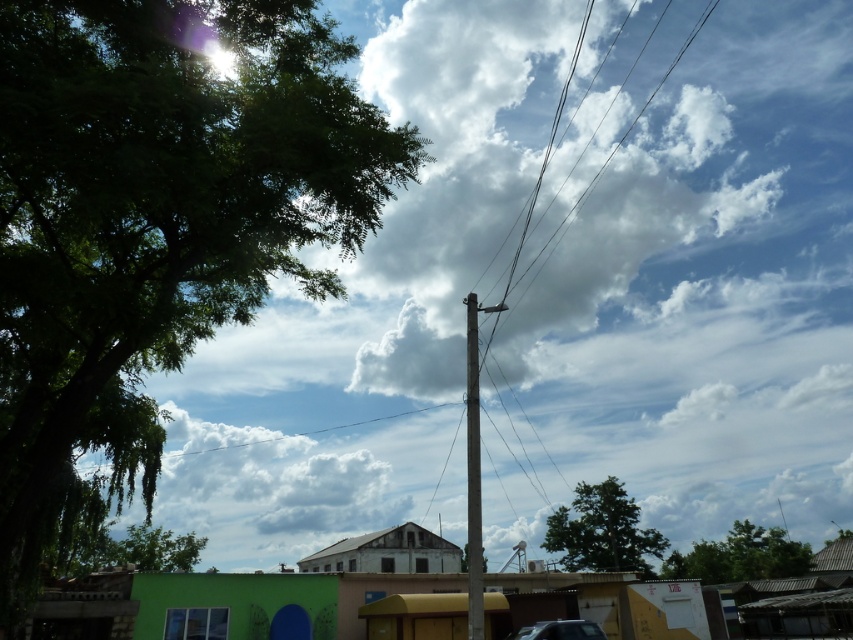
Question: Which point is closer to the camera taking this photo?

Choices:
 (A) (555, 125)
 (B) (476, 324)

Answer: (B)

Question: Can you confirm if green leafy tree at lower right is smaller than green leafy tree at lower left?

Choices:
 (A) yes
 (B) no

Answer: (A)

Question: Is green leafy tree at lower right closer to camera compared to gray wooden telegraph pole at center?

Choices:
 (A) yes
 (B) no

Answer: (B)

Question: Which object is closer to the camera taking this photo?

Choices:
 (A) wire/cable at upper center
 (B) green leafy tree at center
 (C) gray wooden telegraph pole at center
 (D) green leafy tree at lower left

Answer: (C)

Question: Can you confirm if green leafy tree at center is positioned to the right of gray wooden telegraph pole at center?

Choices:
 (A) yes
 (B) no

Answer: (A)

Question: Which object appears closest to the camera in this image?

Choices:
 (A) green leafy tree at lower right
 (B) green leafy tree at left
 (C) wire/cable at upper center

Answer: (B)